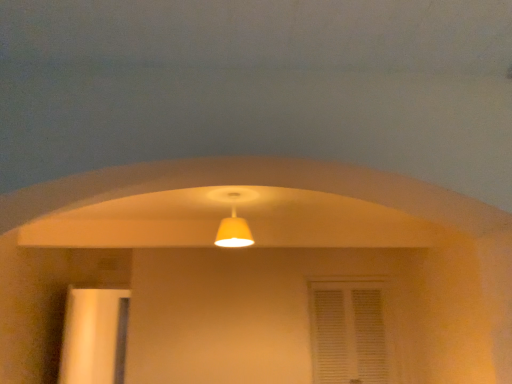
This screenshot has width=512, height=384. Describe the element at coordinates (348, 330) in the screenshot. I see `white textured window at center` at that location.

What do you see at coordinates (234, 232) in the screenshot?
I see `matte yellow lampshade at center` at bounding box center [234, 232].

This screenshot has height=384, width=512. Identify the location of white textured window at center. (348, 330).

From the image's perspective, is matte yellow lampshade at center located beneath white textured window at center?

Actually, matte yellow lampshade at center appears above white textured window at center in the image.

Is matte yellow lampshade at center shorter than white textured window at center?

Yes.

Based on the photo, based on their positions, is matte yellow lampshade at center located to the left or right of white textured window at center?

From the image, it's evident that matte yellow lampshade at center is to the left of white textured window at center.

Measure the distance between white textured window at center and wooden door at left.

A distance of 2.13 meters exists between white textured window at center and wooden door at left.

What's the angular difference between white textured window at center and wooden door at left's facing directions?

white textured window at center and wooden door at left are facing 2.49 degrees away from each other.

Is white textured window at center inside or outside of wooden door at left?

white textured window at center is not enclosed by wooden door at left.

Is point (344, 297) closer to camera compared to point (122, 359)?

No, (344, 297) is behind (122, 359).

Between wooden door at left and white textured window at center, which one has smaller width?

With smaller width is white textured window at center.

Is wooden door at left smaller than white textured window at center?

No, wooden door at left is not smaller than white textured window at center.

From a real-world perspective, does wooden door at left sit lower than white textured window at center?

Indeed, from a real-world perspective, wooden door at left is positioned beneath white textured window at center.

Is wooden door at left beside white textured window at center?

No, wooden door at left is not touching white textured window at center.

From a real-world perspective, does matte yellow lampshade at center sit lower than wooden door at left?

Actually, matte yellow lampshade at center is physically above wooden door at left in the real world.

Is matte yellow lampshade at center shorter than wooden door at left?

Correct, matte yellow lampshade at center is not as tall as wooden door at left.

Which is more distant, (252, 243) or (124, 301)?

Positioned behind is point (124, 301).

Is white textured window at center aimed at matte yellow lampshade at center?

Answer: No.

Is white textured window at center far away from matte yellow lampshade at center?

Yes, white textured window at center and matte yellow lampshade at center are located far from each other.

Is white textured window at center to the right of matte yellow lampshade at center from the viewer's perspective?

Yes, white textured window at center is to the right of matte yellow lampshade at center.

Which object is closer to the camera, white textured window at center or matte yellow lampshade at center?

Positioned in front is matte yellow lampshade at center.

Between wooden door at left and matte yellow lampshade at center, which one has less height?

Standing shorter between the two is matte yellow lampshade at center.

From a real-world perspective, is wooden door at left positioned over matte yellow lampshade at center based on gravity?

No, from a real-world perspective, wooden door at left is not over matte yellow lampshade at center

Does wooden door at left appear on the left side of matte yellow lampshade at center?

Correct, you'll find wooden door at left to the left of matte yellow lampshade at center.

From the picture: Looking at their sizes, would you say wooden door at left is wider or thinner than matte yellow lampshade at center?

wooden door at left is thinner than matte yellow lampshade at center.

Find the location of a particular element. lamp in front of the white textured window at center is located at coordinates (234, 232).

The height and width of the screenshot is (384, 512). I want to click on door that appears behind the white textured window at center, so click(94, 336).

Considering their positions, is white textured window at center positioned closer to matte yellow lampshade at center than wooden door at left?

The object closer to matte yellow lampshade at center is white textured window at center.

Based on the photo, from the image, which object appears to be farther from wooden door at left, matte yellow lampshade at center or white textured window at center?

white textured window at center is further to wooden door at left.

Based on their spatial positions, is wooden door at left or white textured window at center further from matte yellow lampshade at center?

The object further to matte yellow lampshade at center is wooden door at left.

Considering their positions, is matte yellow lampshade at center positioned closer to white textured window at center than wooden door at left?

The object closer to white textured window at center is matte yellow lampshade at center.

Which object lies nearer to the anchor point white textured window at center, wooden door at left or matte yellow lampshade at center?

matte yellow lampshade at center is closer to white textured window at center.

From the picture: Based on their spatial positions, is white textured window at center or matte yellow lampshade at center closer to wooden door at left?

matte yellow lampshade at center lies closer to wooden door at left than the other object.

The height and width of the screenshot is (384, 512). I want to click on lamp located between wooden door at left and white textured window at center in the left-right direction, so click(x=234, y=232).